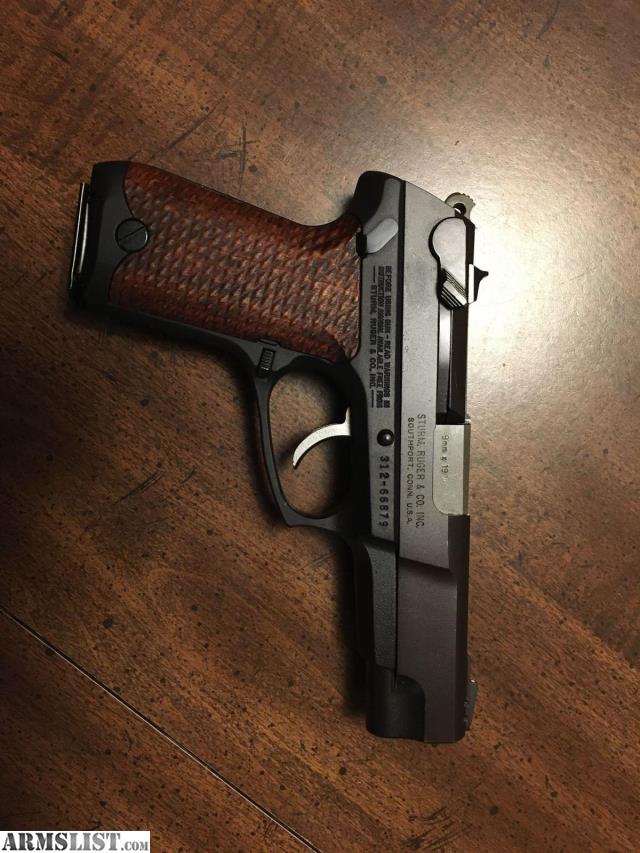
Locate an element on the screen. This screenshot has width=640, height=853. table seam is located at coordinates (271, 817).